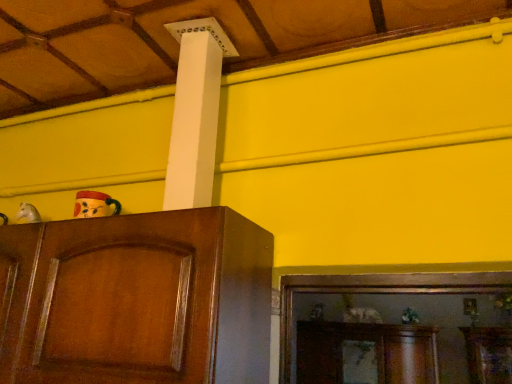
Image resolution: width=512 pixels, height=384 pixels. What are the coordinates of `matte wooden mask at left, the 1th toy in the top-to-bottom sequence` in the screenshot? It's located at (94, 205).

Measure the distance between green matte plant at lower right, the third toy when ordered from top to bottom, and camera.

They are 13.65 feet apart.

Image resolution: width=512 pixels, height=384 pixels. What are the coordinates of `shiny brown cabinet at left` in the screenshot? It's located at (137, 300).

The width and height of the screenshot is (512, 384). What do you see at coordinates (28, 213) in the screenshot? I see `white matte horse head at left, the second toy when ordered from front to back` at bounding box center [28, 213].

You are a GUI agent. You are given a task and a screenshot of the screen. Output one action in this format:
    pyautogui.click(x=<x>, y=<y>)
    Task: Click on the matte wooden mask at left, the 1th toy in the top-to-bottom sequence
    
    Given the screenshot: What is the action you would take?
    pyautogui.click(x=94, y=205)

Which is closer, (24, 217) or (83, 207)?

Point (24, 217) appears to be farther away from the viewer than point (83, 207).

Considering the relative positions of white matte horse head at left, positioned as the 2th toy in bottom-to-top order, and matte wooden mask at left, arranged as the first toy when viewed from the front, in the image provided, is white matte horse head at left, positioned as the 2th toy in bottom-to-top order, to the right of matte wooden mask at left, arranged as the first toy when viewed from the front, from the viewer's perspective?

No, white matte horse head at left, positioned as the 2th toy in bottom-to-top order, is not to the right of matte wooden mask at left, arranged as the first toy when viewed from the front.

At what (x,y) coordinates should I click in order to perform the action: click on toy that appears in front of the white matte horse head at left, the 2th toy positioned from the top. Please return your answer as a coordinate pair (x, y). This screenshot has height=384, width=512. Looking at the image, I should click on (94, 205).

Locate an element on the screen. Image resolution: width=512 pixels, height=384 pixels. toy that is the 2nd one when counting leftward from the green matte plant at lower right, the third toy when ordered from top to bottom is located at coordinates (28, 213).

Who is smaller, green matte plant at lower right, the first toy in the bottom-to-top sequence, or white matte horse head at left, marked as the 3th toy in a right-to-left arrangement?

With smaller size is white matte horse head at left, marked as the 3th toy in a right-to-left arrangement.

How different are the orientations of green matte plant at lower right, the 3th toy in the left-to-right sequence, and white matte horse head at left, marked as the 3th toy in a right-to-left arrangement, in degrees?

The angular difference between green matte plant at lower right, the 3th toy in the left-to-right sequence, and white matte horse head at left, marked as the 3th toy in a right-to-left arrangement, is 0.00171 degrees.

How distant is green matte plant at lower right, the 1th toy from the right, from white matte horse head at left, the 2th toy positioned from the top?

The distance of green matte plant at lower right, the 1th toy from the right, from white matte horse head at left, the 2th toy positioned from the top, is 3.70 meters.

Does point (86, 202) lie behind point (36, 215)?

No, it is in front of (36, 215).

Who is taller, matte wooden mask at left, the 3th toy viewed from the back, or white matte horse head at left, positioned as the second toy in back-to-front order?

matte wooden mask at left, the 3th toy viewed from the back, is taller.

Is matte wooden mask at left, arranged as the first toy when viewed from the front, to the left or to the right of white matte horse head at left, positioned as the 2th toy in bottom-to-top order, in the image?

Clearly, matte wooden mask at left, arranged as the first toy when viewed from the front, is on the right of white matte horse head at left, positioned as the 2th toy in bottom-to-top order, in the image.

Is matte wooden mask at left, the 1th toy in the top-to-bottom sequence, positioned beyond the bounds of white matte horse head at left, positioned as the second toy in back-to-front order?

matte wooden mask at left, the 1th toy in the top-to-bottom sequence, is positioned outside white matte horse head at left, positioned as the second toy in back-to-front order.

In the scene shown: Is white matte horse head at left, the second toy when ordered from front to back, oriented towards green matte plant at lower right, the first toy in the bottom-to-top sequence?

No, white matte horse head at left, the second toy when ordered from front to back, does not turn towards green matte plant at lower right, the first toy in the bottom-to-top sequence.

Who is shorter, white matte horse head at left, marked as the 3th toy in a right-to-left arrangement, or green matte plant at lower right, the 1th toy positioned from the back?

white matte horse head at left, marked as the 3th toy in a right-to-left arrangement.

Is white matte horse head at left, the 2th toy positioned from the top, outside of green matte plant at lower right, the 1th toy positioned from the back?

Yes, white matte horse head at left, the 2th toy positioned from the top, is not within green matte plant at lower right, the 1th toy positioned from the back.

From the picture: From a real-world perspective, is white matte horse head at left, the second toy when ordered from front to back, on green matte plant at lower right, the 3th toy in the left-to-right sequence?

Correct, in the physical world, white matte horse head at left, the second toy when ordered from front to back, is higher than green matte plant at lower right, the 3th toy in the left-to-right sequence.

From a real-world perspective, is shiny brown cabinet at left on top of white matte horse head at left, the 2th toy positioned from the top?

No, from a real-world perspective, shiny brown cabinet at left is not over white matte horse head at left, the 2th toy positioned from the top

Could white matte horse head at left, positioned as the second toy in back-to-front order, be considered to be inside shiny brown cabinet at left?

No, white matte horse head at left, positioned as the second toy in back-to-front order, is not surrounded by shiny brown cabinet at left.

Can you confirm if shiny brown cabinet at left is positioned to the left of white matte horse head at left, positioned as the second toy in back-to-front order?

Incorrect, shiny brown cabinet at left is not on the left side of white matte horse head at left, positioned as the second toy in back-to-front order.

Considering the sizes of objects shiny brown cabinet at left and white matte horse head at left, the first toy viewed from the left, in the image provided, who is thinner, shiny brown cabinet at left or white matte horse head at left, the first toy viewed from the left,?

Thinner between the two is white matte horse head at left, the first toy viewed from the left.

From the picture: Does matte wooden mask at left, the 1th toy in the top-to-bottom sequence, have a greater width compared to shiny brown cabinet at left?

No.

Find the location of a particular element. Image resolution: width=512 pixels, height=384 pixels. toy that is the 1st one when counting backward from the shiny brown cabinet at left is located at coordinates (94, 205).

Considering the relative positions of matte wooden mask at left, arranged as the 3th toy when ordered from the bottom, and shiny brown cabinet at left in the image provided, is matte wooden mask at left, arranged as the 3th toy when ordered from the bottom, to the left of shiny brown cabinet at left from the viewer's perspective?

Yes, matte wooden mask at left, arranged as the 3th toy when ordered from the bottom, is to the left of shiny brown cabinet at left.

Considering the positions of point (91, 207) and point (83, 248), is point (91, 207) closer or farther from the camera than point (83, 248)?

Point (91, 207) is positioned farther from the camera compared to point (83, 248).

Consider the image. Looking at the image, does shiny brown cabinet at left seem bigger or smaller compared to matte wooden mask at left, arranged as the first toy when viewed from the front?

shiny brown cabinet at left is bigger than matte wooden mask at left, arranged as the first toy when viewed from the front.

Which object is positioned more to the left, shiny brown cabinet at left or matte wooden mask at left, which is counted as the second toy, starting from the right?

matte wooden mask at left, which is counted as the second toy, starting from the right, is more to the left.

From a real-world perspective, which is physically below, shiny brown cabinet at left or matte wooden mask at left, which is counted as the second toy, starting from the right?

shiny brown cabinet at left, from a real-world perspective.

Starting from the matte wooden mask at left, which is counted as the second toy, starting from the right, which toy is the 1st one behind? Please provide its 2D coordinates.

[(28, 213)]

Locate an element on the screen. The width and height of the screenshot is (512, 384). toy below the white matte horse head at left, marked as the 3th toy in a right-to-left arrangement (from the image's perspective) is located at coordinates pyautogui.click(x=410, y=316).

Estimate the real-world distances between objects in this image. Which object is further from white matte horse head at left, the first toy viewed from the left, matte wooden mask at left, the 1th toy in the top-to-bottom sequence, or green matte plant at lower right, the first toy in the bottom-to-top sequence?

green matte plant at lower right, the first toy in the bottom-to-top sequence, is further to white matte horse head at left, the first toy viewed from the left.

When comparing their distances from white matte horse head at left, the first toy viewed from the left, does shiny brown cabinet at left or matte wooden mask at left, the 3th toy viewed from the back, seem closer?

The object closer to white matte horse head at left, the first toy viewed from the left, is matte wooden mask at left, the 3th toy viewed from the back.

When comparing their distances from shiny brown cabinet at left, does matte wooden mask at left, arranged as the 3th toy when ordered from the bottom, or green matte plant at lower right, the third toy when ordered from top to bottom, seem closer?

matte wooden mask at left, arranged as the 3th toy when ordered from the bottom.

When comparing their distances from shiny brown cabinet at left, does green matte plant at lower right, the 3th toy in the left-to-right sequence, or matte wooden mask at left, which is counted as the second toy, starting from the right, seem further?

green matte plant at lower right, the 3th toy in the left-to-right sequence, is further to shiny brown cabinet at left.

Looking at this image, from the image, which object appears to be nearer to matte wooden mask at left, which is counted as the second toy, starting from the right, white matte horse head at left, the 2th toy positioned from the top, or shiny brown cabinet at left?

shiny brown cabinet at left is closer to matte wooden mask at left, which is counted as the second toy, starting from the right.

Which object lies nearer to the anchor point white matte horse head at left, the first toy viewed from the left, shiny brown cabinet at left or green matte plant at lower right, the 1th toy from the right?

shiny brown cabinet at left is positioned closer to the anchor white matte horse head at left, the first toy viewed from the left.

In the scene shown: When comparing their distances from shiny brown cabinet at left, does white matte horse head at left, positioned as the 2th toy in bottom-to-top order, or green matte plant at lower right, arranged as the third toy when viewed from the front, seem further?

green matte plant at lower right, arranged as the third toy when viewed from the front, lies further to shiny brown cabinet at left than the other object.

Considering their positions, is white matte horse head at left, the second toy when ordered from front to back, positioned further to green matte plant at lower right, the first toy in the bottom-to-top sequence, than matte wooden mask at left, the 1th toy in the top-to-bottom sequence?

matte wooden mask at left, the 1th toy in the top-to-bottom sequence, is further to green matte plant at lower right, the first toy in the bottom-to-top sequence.

Find the location of `toy located between matte wooden mask at left, arranged as the 3th toy when ordered from the bottom, and green matte plant at lower right, the first toy in the bottom-to-top sequence, in the depth direction`. toy located between matte wooden mask at left, arranged as the 3th toy when ordered from the bottom, and green matte plant at lower right, the first toy in the bottom-to-top sequence, in the depth direction is located at coordinates (28, 213).

Where is `toy located between shiny brown cabinet at left and white matte horse head at left, marked as the 3th toy in a right-to-left arrangement, in the depth direction`? toy located between shiny brown cabinet at left and white matte horse head at left, marked as the 3th toy in a right-to-left arrangement, in the depth direction is located at coordinates (94, 205).